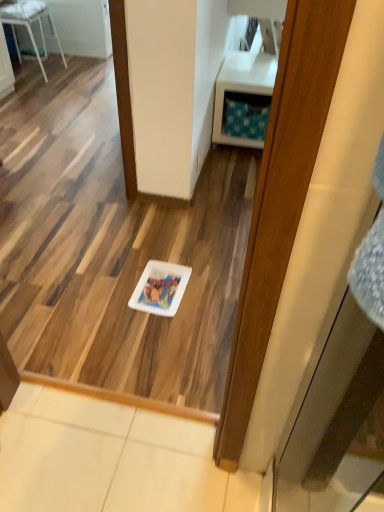
Describe the element at coordinates (244, 98) in the screenshot. I see `white plastic vanity at upper right` at that location.

The image size is (384, 512). What do you see at coordinates (30, 25) in the screenshot? I see `white glossy chair at upper left` at bounding box center [30, 25].

Where is `white plastic vanity at upper right`? The height and width of the screenshot is (512, 384). white plastic vanity at upper right is located at coordinates (244, 98).

From the image's perspective, which one is positioned lower, white glossy chair at upper left or white plastic vanity at upper right?

white plastic vanity at upper right is shown below in the image.

Locate an element on the screen. The image size is (384, 512). furniture on the left of white plastic vanity at upper right is located at coordinates (30, 25).

Is white glossy chair at upper left positioned with its back to white plastic vanity at upper right?

That's right, white glossy chair at upper left is facing away from white plastic vanity at upper right.

From a real-world perspective, is white glossy chair at upper left beneath white plastic vanity at upper right?

No.

Would you consider white glossy chair at upper left to be distant from white glossy plate at center?

Yes, white glossy chair at upper left and white glossy plate at center are located far from each other.

Is white glossy chair at upper left situated inside white glossy plate at center or outside?

white glossy chair at upper left is not enclosed by white glossy plate at center.

Does white glossy chair at upper left come behind white glossy plate at center?

Yes, white glossy chair at upper left is behind white glossy plate at center.

How much distance is there between white glossy chair at upper left and white glossy plate at center?

The distance of white glossy chair at upper left from white glossy plate at center is 2.55 meters.

Could you tell me if white plastic vanity at upper right is turned towards white glossy chair at upper left?

No, white plastic vanity at upper right is not aimed at white glossy chair at upper left.

From a real-world perspective, is white plastic vanity at upper right located beneath white glossy chair at upper left?

Yes, from a real-world perspective, white plastic vanity at upper right is below white glossy chair at upper left.

Looking at this image, can you confirm if white plastic vanity at upper right is wider than white glossy chair at upper left?

In fact, white plastic vanity at upper right might be narrower than white glossy chair at upper left.

Is white plastic vanity at upper right positioned beyond the bounds of white glossy chair at upper left?

white plastic vanity at upper right lies outside white glossy chair at upper left's area.

Which object is closer to the camera, white glossy plate at center or white plastic vanity at upper right?

white glossy plate at center.

Could you tell me if white glossy plate at center is turned towards white plastic vanity at upper right?

No, white glossy plate at center is not aimed at white plastic vanity at upper right.

Considering the positions of objects white glossy plate at center and white plastic vanity at upper right in the image provided, who is more to the left, white glossy plate at center or white plastic vanity at upper right?

Positioned to the left is white glossy plate at center.

At what (x,y) coordinates should I click in order to perform the action: click on vanity on the right of the white glossy plate at center. Please return your answer as a coordinate pair (x, y). Looking at the image, I should click on (244, 98).

Is white plastic vanity at upper right not close to white glossy plate at center?

white plastic vanity at upper right is positioned a significant distance from white glossy plate at center.

From a real-world perspective, is white plastic vanity at upper right above or below white glossy plate at center?

white plastic vanity at upper right is above white glossy plate at center.

Considering the relative positions of white plastic vanity at upper right and white glossy plate at center in the image provided, is white plastic vanity at upper right to the left or to the right of white glossy plate at center?

white plastic vanity at upper right is to the right of white glossy plate at center.

Which is less distant, (255, 135) or (149, 283)?

The point (149, 283) is closer.

Which object is further away from the camera taking this photo, white glossy plate at center or white glossy chair at upper left?

white glossy chair at upper left is behind.

Between point (175, 287) and point (17, 1), which one is positioned in front?

The point (175, 287) is closer to the camera.

Is white glossy plate at center outside of white glossy chair at upper left?

white glossy plate at center is positioned outside white glossy chair at upper left.

From the image's perspective, is white glossy plate at center beneath white glossy chair at upper left?

Yes, from the image's perspective, white glossy plate at center is beneath white glossy chair at upper left.

You are a GUI agent. You are given a task and a screenshot of the screen. Output one action in this format:
    pyautogui.click(x=<x>, y=<y>)
    Task: Click on the vanity that appears below the white glossy chair at upper left (from the image's perspective)
    
    Given the screenshot: What is the action you would take?
    pyautogui.click(x=244, y=98)

I want to click on furniture that appears above the white glossy plate at center (from a real-world perspective), so click(x=30, y=25).

From the image, which object appears to be farther from white plastic vanity at upper right, white glossy chair at upper left or white glossy plate at center?

white glossy chair at upper left lies further to white plastic vanity at upper right than the other object.

Which object lies nearer to the anchor point white glossy plate at center, white glossy chair at upper left or white plastic vanity at upper right?

Among the two, white plastic vanity at upper right is located nearer to white glossy plate at center.

Consider the image. Which object lies further to the anchor point white glossy plate at center, white plastic vanity at upper right or white glossy chair at upper left?

The object further to white glossy plate at center is white glossy chair at upper left.

Based on their spatial positions, is white glossy plate at center or white glossy chair at upper left further from white plastic vanity at upper right?

Among the two, white glossy chair at upper left is located further to white plastic vanity at upper right.

In the scene shown: When comparing their distances from white glossy chair at upper left, does white glossy plate at center or white plastic vanity at upper right seem closer?

The object closer to white glossy chair at upper left is white plastic vanity at upper right.

From the picture: Considering their positions, is white plastic vanity at upper right positioned closer to white glossy chair at upper left than white glossy plate at center?

white plastic vanity at upper right is closer to white glossy chair at upper left.

The width and height of the screenshot is (384, 512). Identify the location of vanity between white glossy chair at upper left and white glossy plate at center from top to bottom. (244, 98).